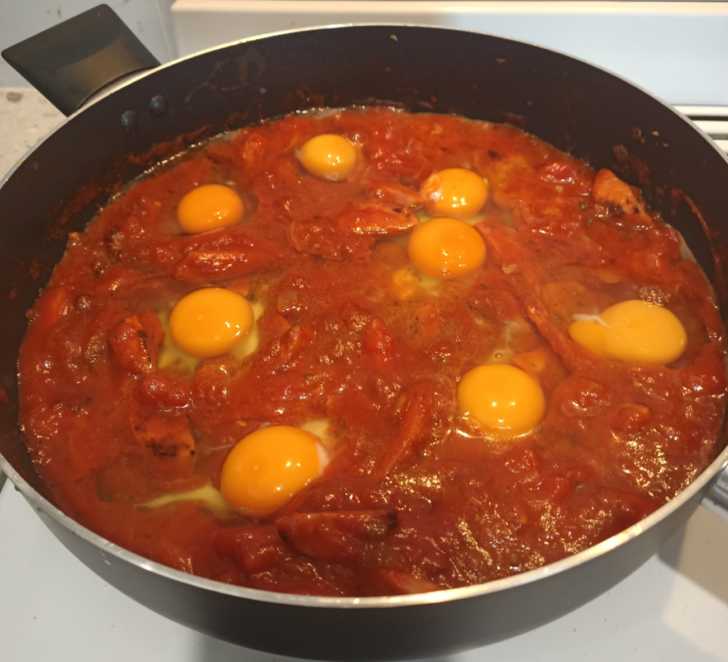
Locate an element on the screen. table in front right of cooking pan is located at coordinates click(x=684, y=621).